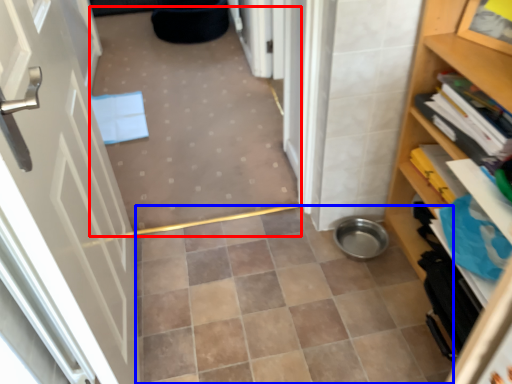
Question: Among these objects, which one is nearest to the camera, plain (highlighted by a red box) or ceramic tile (highlighted by a blue box)?

Choices:
 (A) plain
 (B) ceramic tile

Answer: (A)